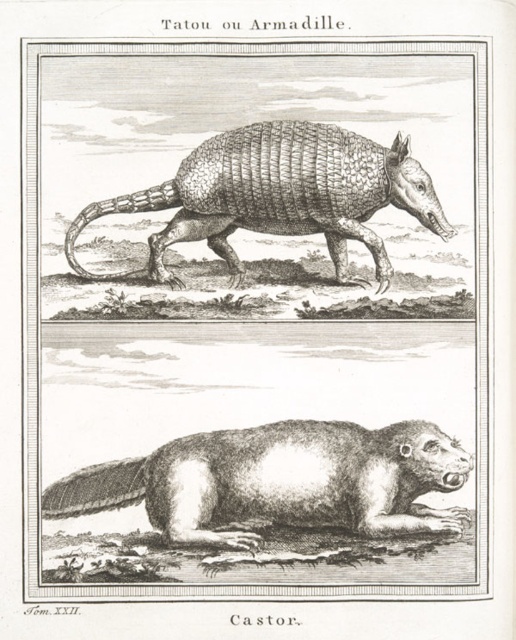
Question: Considering the relative positions of white fur beaver at lower center and gray textured armadillo at upper center in the image provided, where is white fur beaver at lower center located with respect to gray textured armadillo at upper center?

Choices:
 (A) right
 (B) left

Answer: (A)

Question: Is white fur beaver at lower center wider than gray textured armadillo at upper center?

Choices:
 (A) no
 (B) yes

Answer: (B)

Question: Among these objects, which one is nearest to the camera?

Choices:
 (A) white fur beaver at lower center
 (B) gray textured armadillo at upper center

Answer: (A)

Question: Is white fur beaver at lower center bigger than gray textured armadillo at upper center?

Choices:
 (A) no
 (B) yes

Answer: (A)